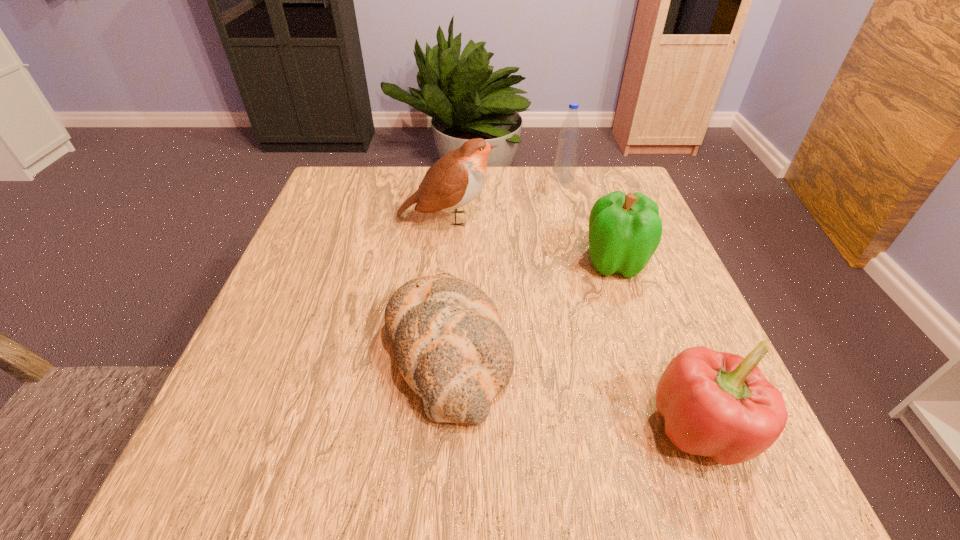
The image size is (960, 540). Find the location of `water bottle that is at the far edge`. water bottle that is at the far edge is located at coordinates (566, 157).

In order to click on bird that is at the far edge in this screenshot , I will do `click(454, 180)`.

Locate an element on the screen. object that is at the near edge is located at coordinates (716, 404).

Image resolution: width=960 pixels, height=540 pixels. I want to click on water bottle located in the right edge section of the desktop, so click(x=566, y=157).

Identify the location of object that is at the far right corner. Image resolution: width=960 pixels, height=540 pixels. (566, 157).

This screenshot has height=540, width=960. What are the coordinates of `object at the near right corner` in the screenshot? It's located at (716, 404).

Where is `vacant space at the far edge of the desktop`? vacant space at the far edge of the desktop is located at coordinates (397, 167).

In the image, there is a desktop. Identify the location of vacant space at the near edge. (388, 483).

Locate an element on the screen. The width and height of the screenshot is (960, 540). vacant space at the left edge of the desktop is located at coordinates (258, 404).

Find the location of a particular element. vacant point at the far left corner is located at coordinates (371, 191).